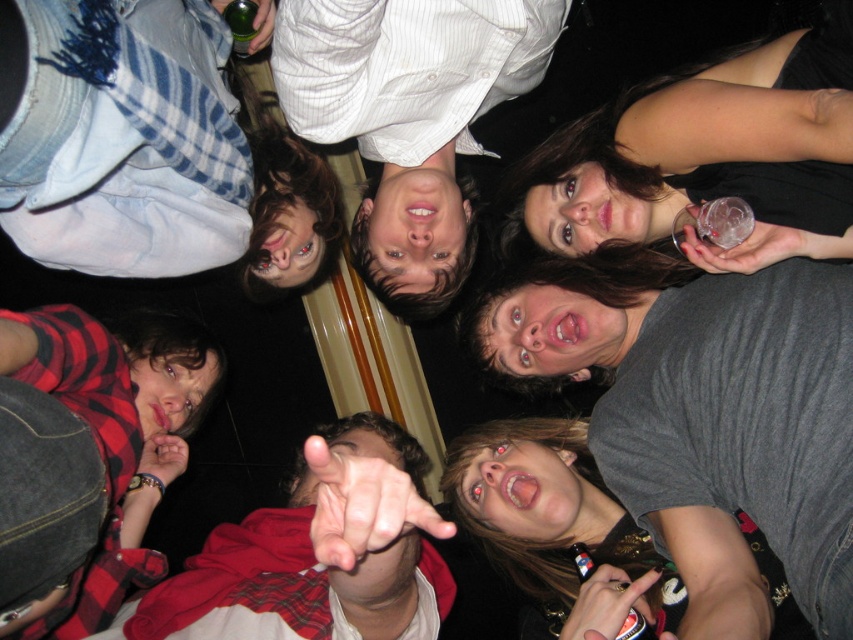
Question: Is smooth white shirt at center smaller than matte gray shirt at lower right?

Choices:
 (A) yes
 (B) no

Answer: (A)

Question: Which of the following is the farthest from the observer?

Choices:
 (A) matte gray shirt at lower right
 (B) plaid shirt at center
 (C) smooth white shirt at center
 (D) denim jacket at upper left

Answer: (A)

Question: Can you confirm if denim jacket at upper left is positioned above plaid shirt at center?

Choices:
 (A) no
 (B) yes

Answer: (B)

Question: Which object is closer to the camera taking this photo?

Choices:
 (A) matte gray shirt at lower right
 (B) plaid shirt at center

Answer: (B)

Question: Which point appears farthest from the camera in this image?

Choices:
 (A) (578, 624)
 (B) (306, 522)
 (C) (234, 161)

Answer: (B)

Question: Is matte black dress at upper right to the right of plaid shirt at center from the viewer's perspective?

Choices:
 (A) no
 (B) yes

Answer: (B)